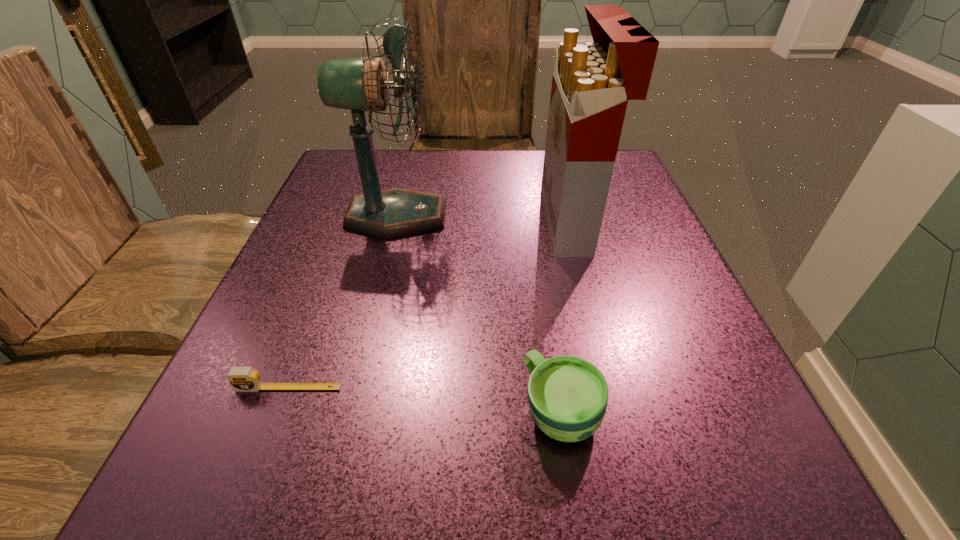
This screenshot has height=540, width=960. In order to click on vacant region at the right edge of the desktop in this screenshot , I will do `click(677, 422)`.

This screenshot has height=540, width=960. I want to click on free space at the far left corner of the desktop, so click(336, 155).

Locate an element on the screen. free region at the near right corner is located at coordinates (748, 450).

At what (x,y) coordinates should I click in order to perform the action: click on free space between the shortest object and the fan. Please return your answer as a coordinate pair (x, y). The width and height of the screenshot is (960, 540). Looking at the image, I should click on (343, 302).

Where is `free space between the shortest object and the cigarette case`? free space between the shortest object and the cigarette case is located at coordinates (430, 305).

At what (x,y) coordinates should I click in order to perform the action: click on free point between the fan and the tape measure. Please return your answer as a coordinate pair (x, y). The image size is (960, 540). Looking at the image, I should click on (343, 302).

You are a GUI agent. You are given a task and a screenshot of the screen. Output one action in this format:
    pyautogui.click(x=<x>, y=<y>)
    Task: Click on the unoccupied position between the cup and the fan
    Image resolution: width=960 pixels, height=540 pixels.
    Given the screenshot: What is the action you would take?
    pyautogui.click(x=479, y=313)

Identify the location of empty space between the shortest object and the cigarette case. The image size is (960, 540). (430, 305).

This screenshot has height=540, width=960. Find the location of `vacant space that's between the cigarette case and the cup`. vacant space that's between the cigarette case and the cup is located at coordinates (566, 316).

Where is `vacant area that lies between the cup and the cigarette case`? vacant area that lies between the cup and the cigarette case is located at coordinates (566, 316).